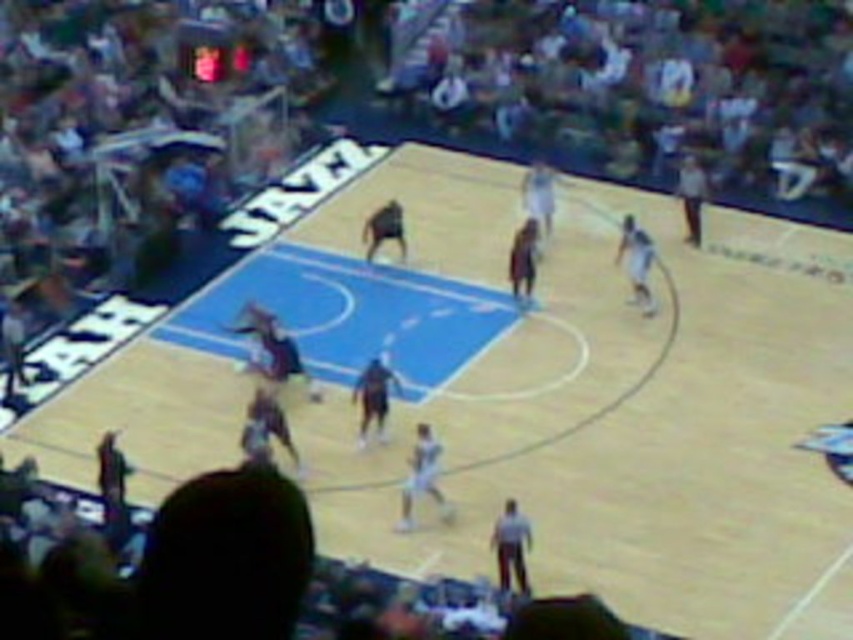
Does light gray uniform at center have a greater width compared to dark brown shorts at center?

No, light gray uniform at center is not wider than dark brown shorts at center.

Is light gray uniform at center bigger than dark brown shorts at center?

No, light gray uniform at center is not bigger than dark brown shorts at center.

Who is more distant from viewer, (494, 545) or (386, 392)?

Positioned behind is point (386, 392).

This screenshot has height=640, width=853. I want to click on light gray uniform at center, so click(511, 545).

Who is taller, white matte basketball player at center or dark brown jersey at center?

Standing taller between the two is white matte basketball player at center.

Measure the distance from white matte basketball player at center to dark brown jersey at center.

white matte basketball player at center and dark brown jersey at center are 25.47 feet apart.

Between point (424, 452) and point (523, 275), which one is positioned behind?

Point (523, 275)

Where is `white matte basketball player at center`? The height and width of the screenshot is (640, 853). white matte basketball player at center is located at coordinates (421, 476).

Is white matte basketball player at right positioned in front of light brown leather jacket at right?

Yes, white matte basketball player at right is in front of light brown leather jacket at right.

Can you confirm if white matte basketball player at right is wider than light brown leather jacket at right?

Correct, the width of white matte basketball player at right exceeds that of light brown leather jacket at right.

This screenshot has width=853, height=640. In order to click on white matte basketball player at right in this screenshot , I will do `click(636, 260)`.